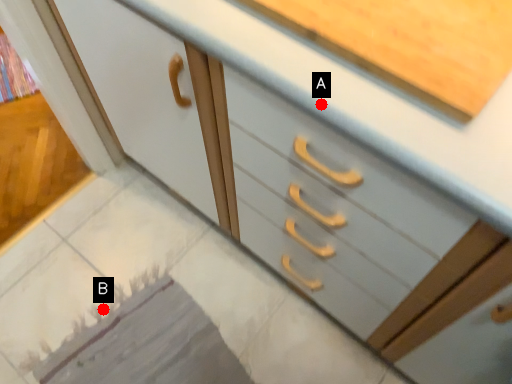
Question: Two points are circled on the image, labeled by A and B beside each circle. Which point is closer to the camera?

Choices:
 (A) A is closer
 (B) B is closer

Answer: (A)